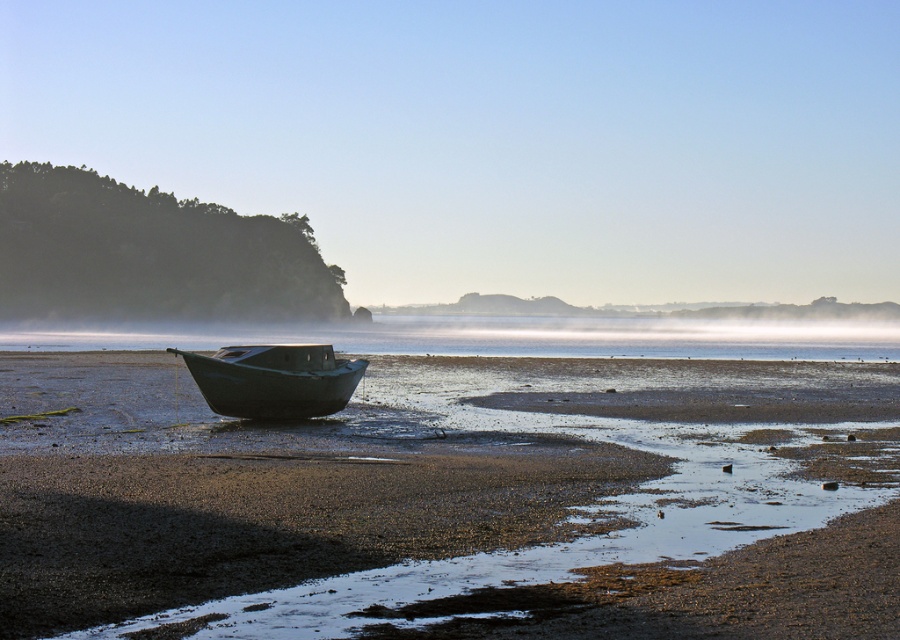
Question: Which point is closer to the camera taking this photo?

Choices:
 (A) (266, 368)
 (B) (829, 588)

Answer: (B)

Question: Among these points, which one is nearest to the camera?

Choices:
 (A) (347, 461)
 (B) (338, 397)

Answer: (A)

Question: Does smooth mud boat at center have a greater width compared to green matte boat at center?

Choices:
 (A) no
 (B) yes

Answer: (B)

Question: From the image, what is the correct spatial relationship of smooth mud boat at center in relation to green matte boat at center?

Choices:
 (A) right
 (B) left

Answer: (A)

Question: Among these objects, which one is farthest from the camera?

Choices:
 (A) green matte boat at center
 (B) smooth mud boat at center

Answer: (A)

Question: Does smooth mud boat at center come in front of green matte boat at center?

Choices:
 (A) yes
 (B) no

Answer: (A)